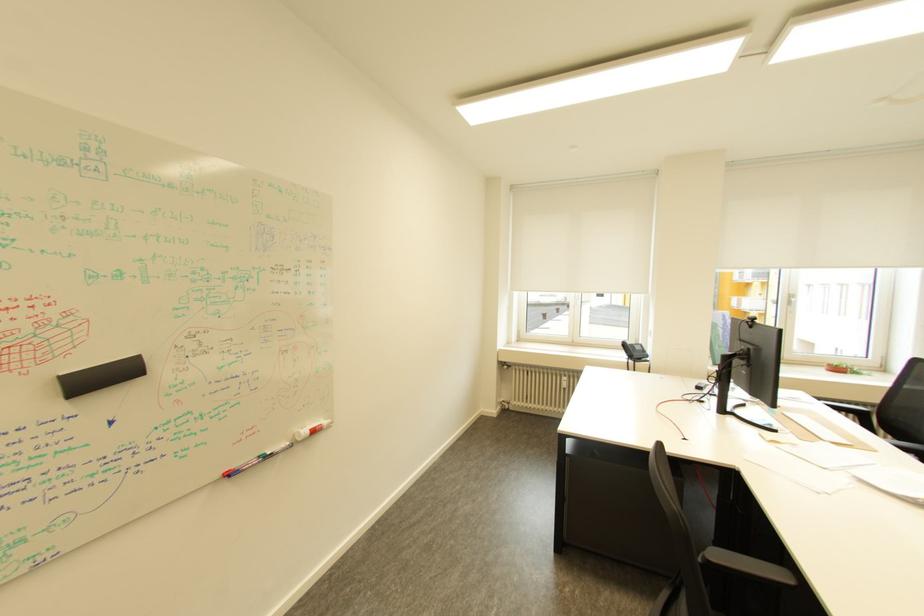
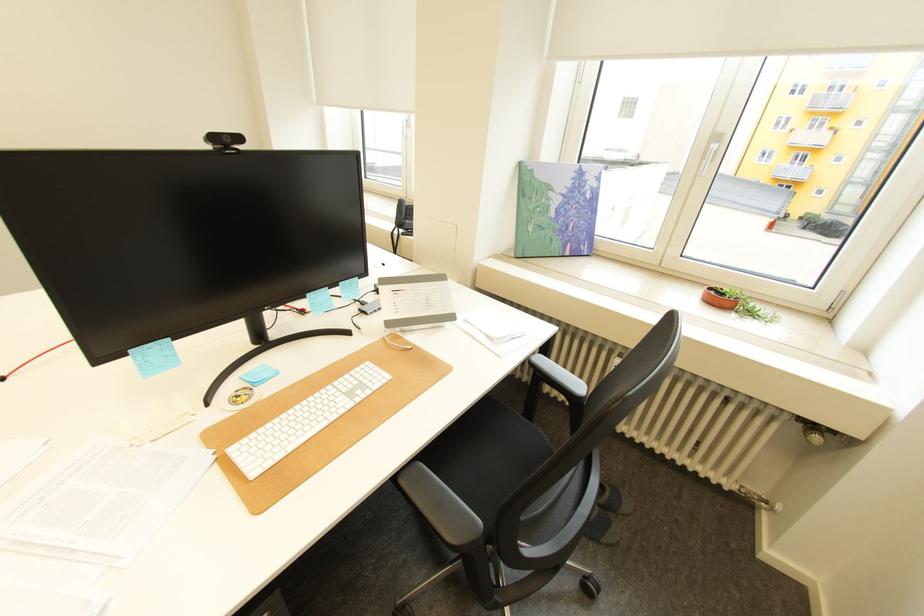
Which direction would the cameraman need to move to produce the second image?

A: The movement direction of the cameraman is right, forward.